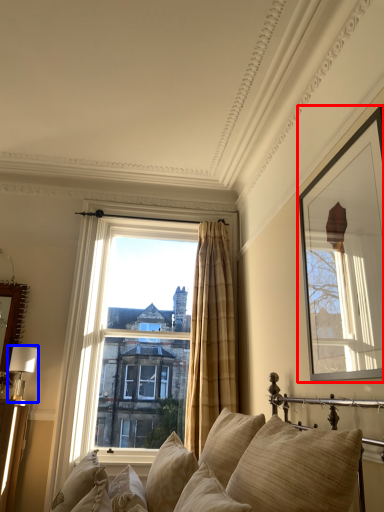
Question: Which of the following is the farthest to the observer, picture frame (highlighted by a red box) or table lamp (highlighted by a blue box)?

Choices:
 (A) picture frame
 (B) table lamp

Answer: (B)